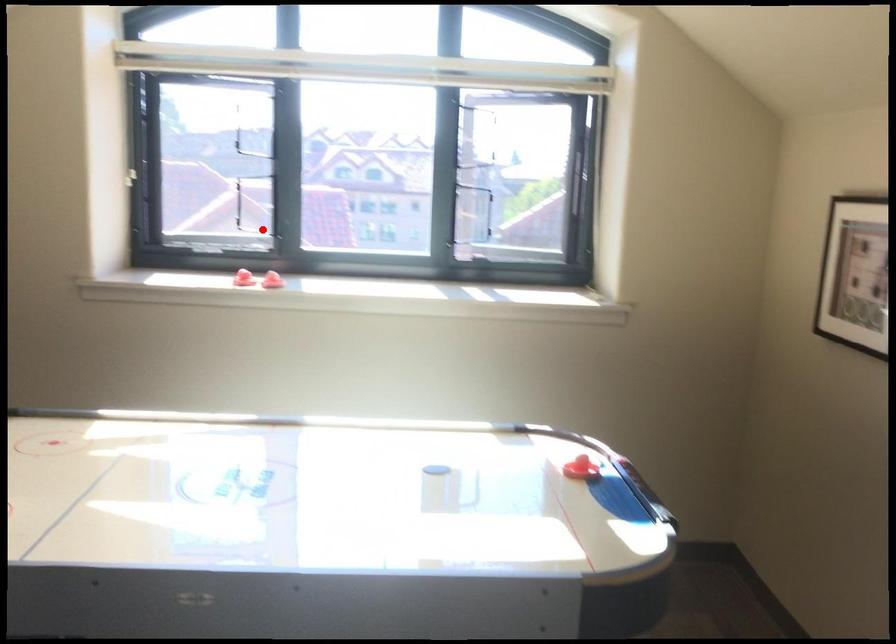
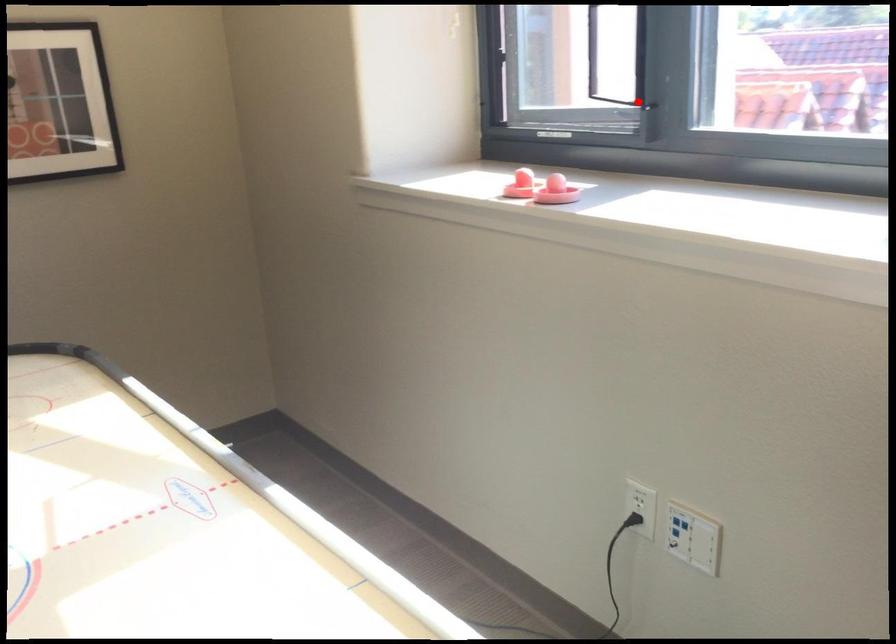
I am providing you with two images of the same scene from different viewpoints. A red point is marked on the first image and another point is marked on the second image. Is the marked point in image1 the same physical position as the marked point in image2?

Yes